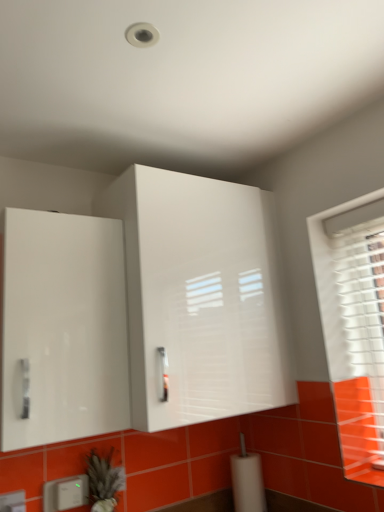
Question: Is white glossy cabinet at upper center, placed as the first cabinetry when sorted from right to left, to the left or to the right of white plastic electric outlet at lower left, which appears as the first electric outlet when viewed from the left, in the image?

Choices:
 (A) right
 (B) left

Answer: (A)

Question: Is white glossy cabinet at upper center, placed as the first cabinetry when sorted from right to left, wider or thinner than white plastic electric outlet at lower left, marked as the 2th electric outlet in a right-to-left arrangement?

Choices:
 (A) thin
 (B) wide

Answer: (B)

Question: Which of these objects is positioned farthest from the white plastic electric outlet at lower left, which ranks as the first electric outlet in front-to-back order?

Choices:
 (A) white glossy cabinet at left, the first cabinetry in the left-to-right sequence
 (B) green fuzzy plant at lower left
 (C) white glossy cabinet at upper center, the 2th cabinetry in the left-to-right sequence
 (D) white plastic electric outlet at lower left, which ranks as the 1th electric outlet in back-to-front order

Answer: (C)

Question: Considering the real-world distances, which object is closest to the green fuzzy plant at lower left?

Choices:
 (A) white glossy cabinet at left, the second cabinetry positioned from the right
 (B) white plastic electric outlet at lower left, arranged as the 2th electric outlet when viewed from the back
 (C) white plastic electric outlet at lower left, acting as the second electric outlet starting from the front
 (D) white glossy cabinet at upper center, the 2th cabinetry in the left-to-right sequence

Answer: (C)